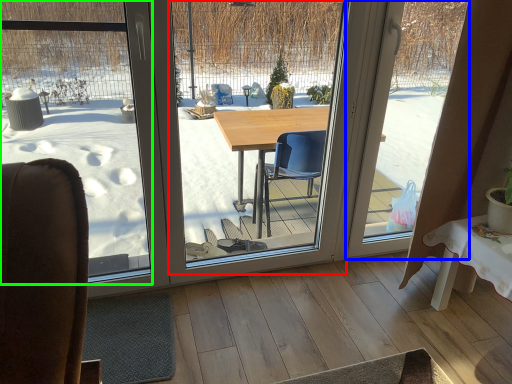
Question: Which object is the farthest from window screen (highlighted by a red box)? Choose among these: window screen (highlighted by a blue box) or window screen (highlighted by a green box).

Choices:
 (A) window screen
 (B) window screen

Answer: (A)